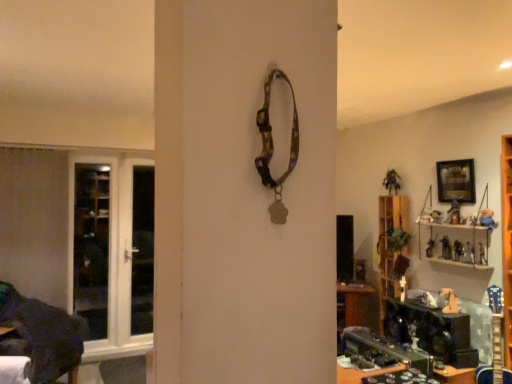
Question: From the image's perspective, is wooden framed picture at upper right above or below wooden shelf at right?

Choices:
 (A) above
 (B) below

Answer: (A)

Question: Looking at their shapes, would you say wooden framed picture at upper right is wider or thinner than wooden shelf at right?

Choices:
 (A) wide
 (B) thin

Answer: (B)

Question: Estimate the real-world distances between objects in this image. Which object is farther from the wooden shelf at right?

Choices:
 (A) wooden framed picture at upper right
 (B) white glossy door at left
 (C) transparent glass screen door at left

Answer: (B)

Question: Which object is the closest to the wooden framed picture at upper right?

Choices:
 (A) transparent glass screen door at left
 (B) wooden shelf at right
 (C) white glossy door at left

Answer: (B)